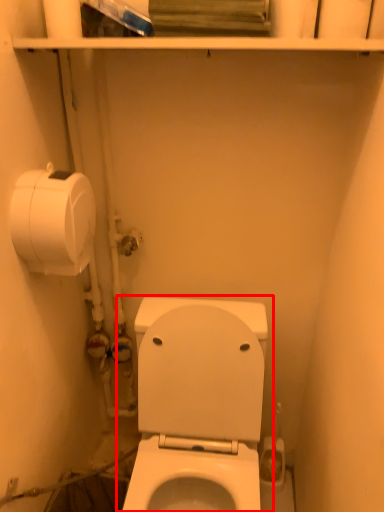
Question: From the image's perspective, where is toilet (annotated by the red box) located relative to toilet paper?

Choices:
 (A) below
 (B) above

Answer: (A)